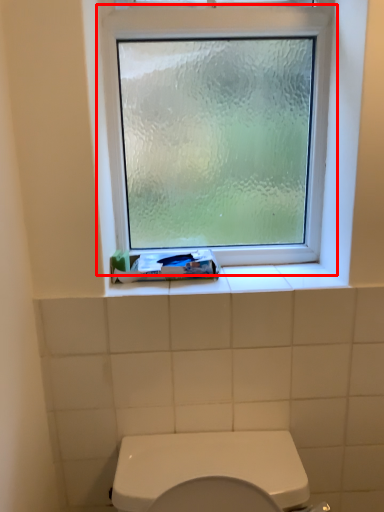
Question: Observing the image, what is the correct spatial positioning of window (annotated by the red box) in reference to toothpaste?

Choices:
 (A) left
 (B) right

Answer: (B)